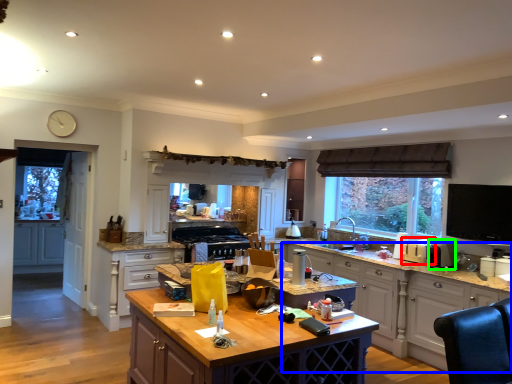
Question: Based on their relative distances, which object is nearer to appliance (highlighted by a red box)? Choose from cabinetry (highlighted by a blue box) and appliance (highlighted by a green box).

Choices:
 (A) cabinetry
 (B) appliance

Answer: (B)